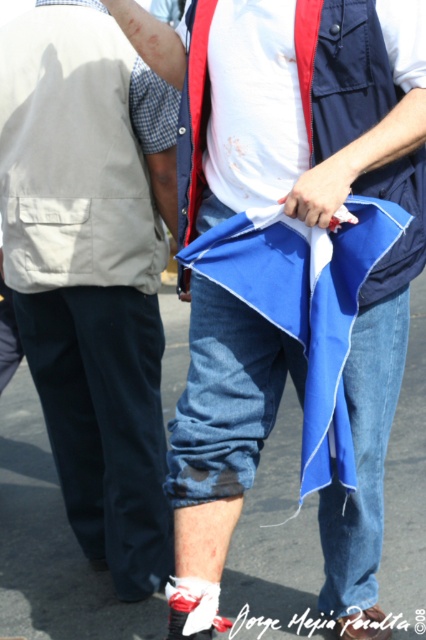
Question: Which of the following is the farthest from the observer?

Choices:
 (A) (88, 292)
 (B) (319, 340)

Answer: (A)

Question: Can you confirm if matte khaki vest at left is positioned to the right of dark blue denim jeans at lower center?

Choices:
 (A) yes
 (B) no

Answer: (B)

Question: Among these points, which one is farthest from the camera?

Choices:
 (A) (275, 228)
 (B) (104, 161)

Answer: (B)

Question: Considering the real-world distances, which object is closest to the dark blue denim jeans at lower center?

Choices:
 (A) blue fabric flag at lower center
 (B) matte khaki vest at left

Answer: (B)

Question: Can you confirm if matte khaki vest at left is wider than dark blue denim jeans at lower center?

Choices:
 (A) no
 (B) yes

Answer: (B)

Question: Can you confirm if matte khaki vest at left is positioned to the left of dark blue denim jeans at lower center?

Choices:
 (A) yes
 (B) no

Answer: (A)